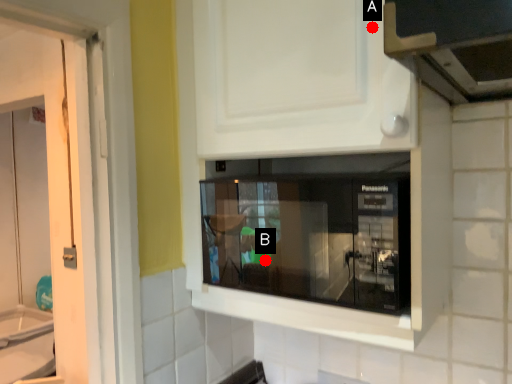
Question: Two points are circled on the image, labeled by A and B beside each circle. Which point is closer to the camera?

Choices:
 (A) A is closer
 (B) B is closer

Answer: (A)